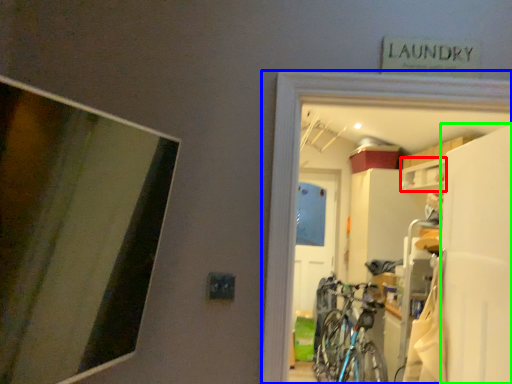
Question: Based on their relative distances, which object is farther from cabinet (highlighted by a red box)? Choose from garage (highlighted by a blue box) and screen door (highlighted by a green box).

Choices:
 (A) garage
 (B) screen door

Answer: (A)